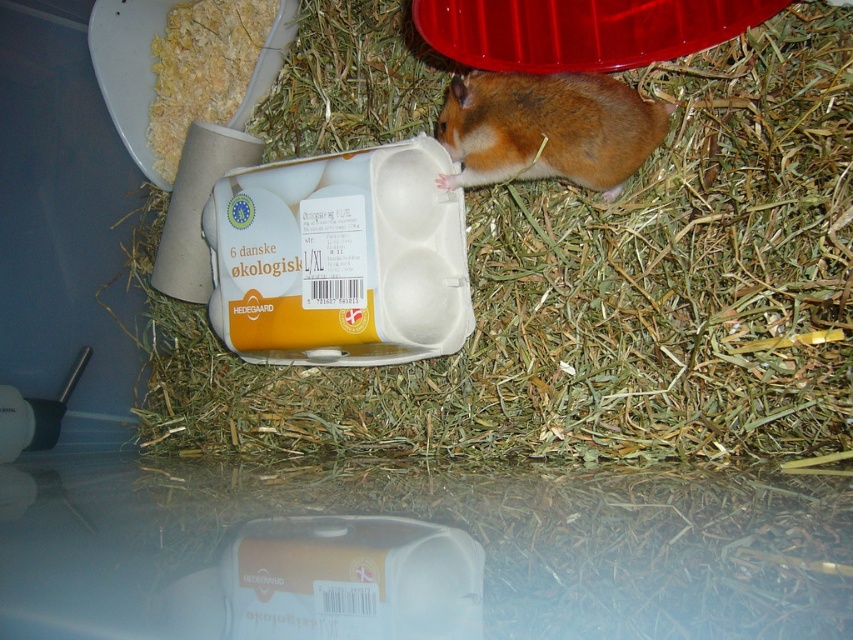
You are a small pet owner who wants to place a new toy in the enclosure. The toy is 10 cm wide. The green straw at center and brown furry hamster at upper right are in the way. Can you place the toy between them?

The green straw at center is positioned on the left side of brown furry hamster at upper right, so there is space between them. The toy can be placed between the green straw at center and brown furry hamster at upper right.

You are a small toy mouse trying to cross from the left side to the right side of the enclosure. There is green straw at center and brown furry hamster at upper right in your path. Can you fit through the space between them?

The green straw at center is wider than the brown furry hamster at upper right, so the space between them may be narrow. However, since the exact distance isn not provided, it is uncertain if the toy mouse can fit through.